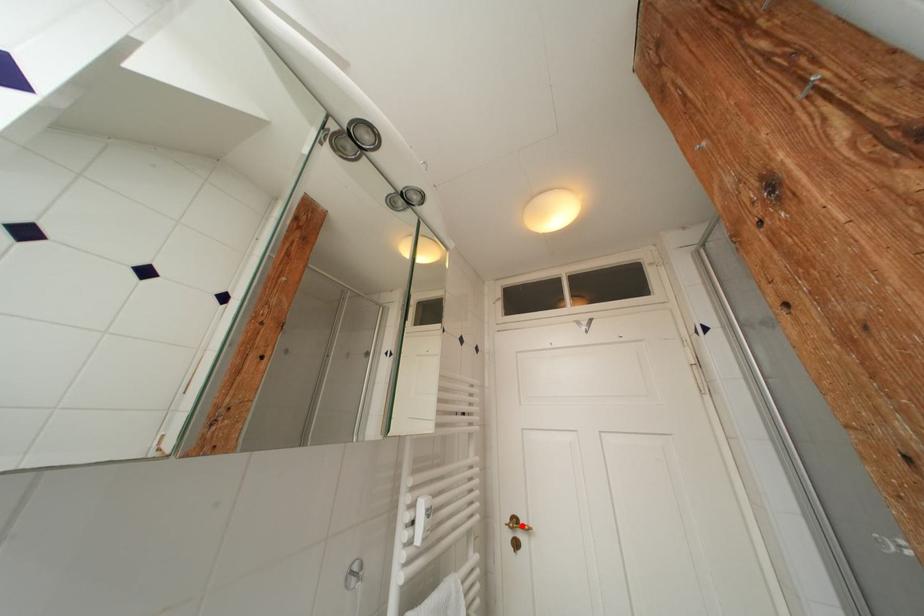
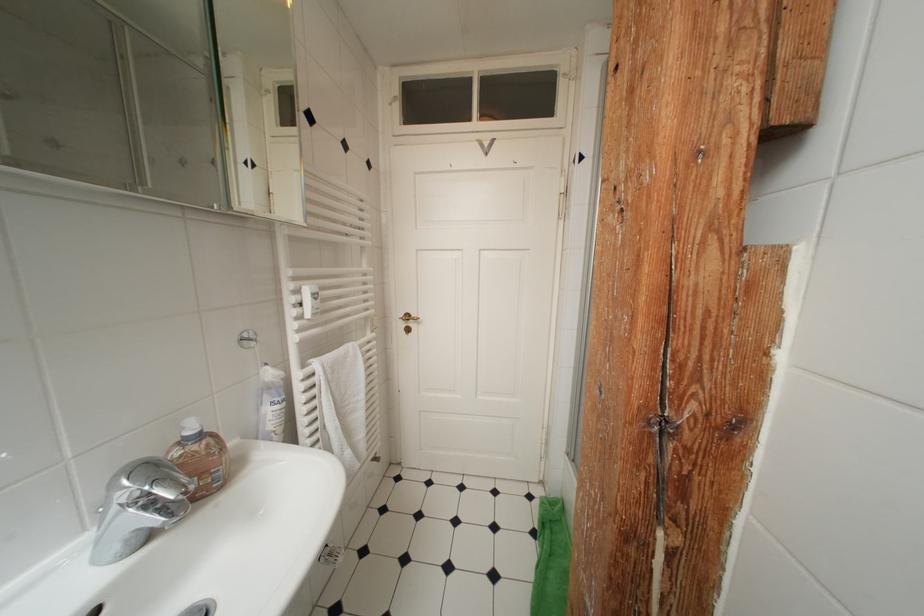
Locate, in the second image, the point that corresponds to the highlighted location in the first image.

(415, 320)